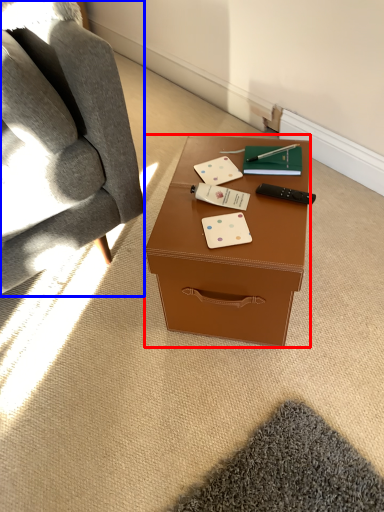
Question: Which object appears closest to the camera in this image, desk (highlighted by a red box) or chair (highlighted by a blue box)?

Choices:
 (A) desk
 (B) chair

Answer: (B)